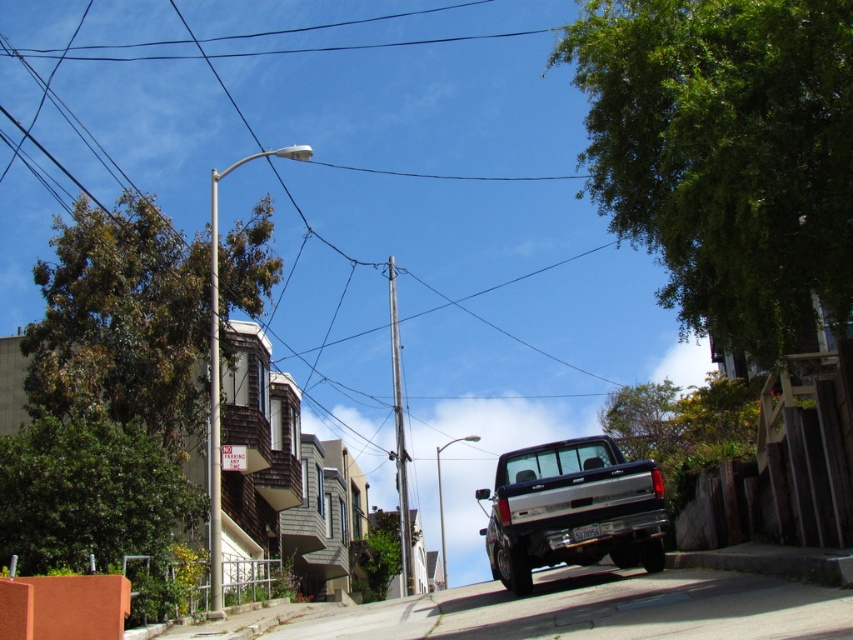
Question: Can you confirm if green leafy tree at upper right is positioned above rusty metal pole at center?

Choices:
 (A) no
 (B) yes

Answer: (B)

Question: Which of these objects is positioned farthest from the metallic silver pole at upper center?

Choices:
 (A) shiny silver truck at center
 (B) green leafy tree at center

Answer: (B)

Question: Which object is the farthest from the shiny silver truck at center?

Choices:
 (A) green leafy tree at lower left
 (B) green leafy tree at upper left
 (C) green leafy tree at upper right

Answer: (B)

Question: Is green leafy tree at upper right closer to the viewer compared to green leafy tree at center?

Choices:
 (A) yes
 (B) no

Answer: (A)

Question: Which point is closer to the camera?

Choices:
 (A) green leafy tree at center
 (B) metallic silver pole at upper center

Answer: (B)

Question: Does green leafy tree at upper right have a greater width compared to green leafy tree at center?

Choices:
 (A) no
 (B) yes

Answer: (A)